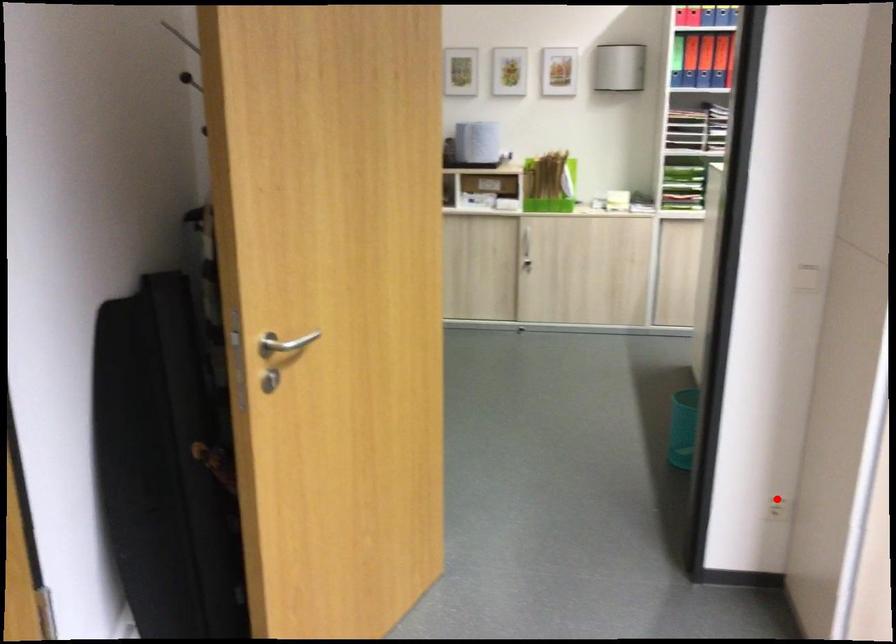
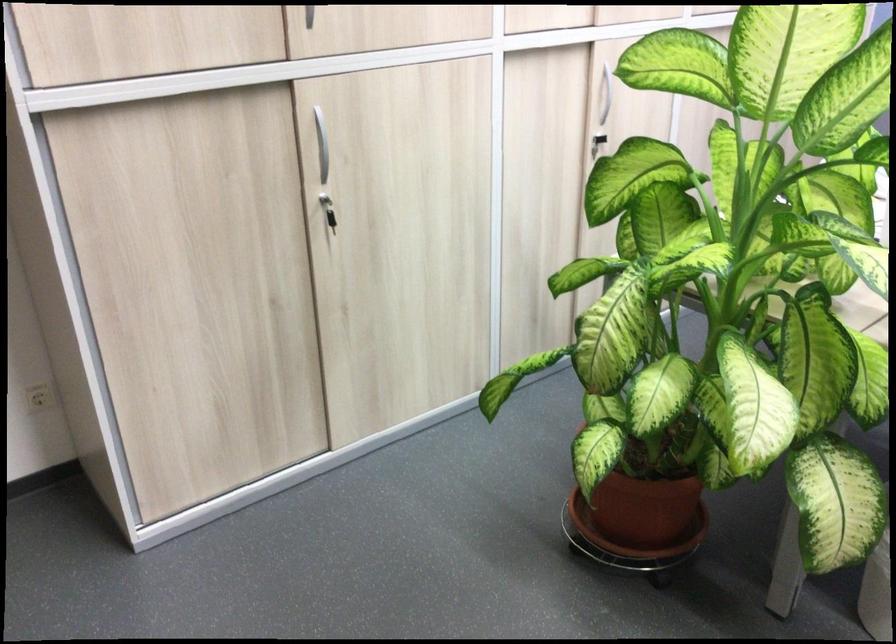
Question: I am providing you with two images of the same scene from different viewpoints. In image1, a red point is highlighted. Considering the same 3D point in image2, which of the following is correct?

Choices:
 (A) It is closer
 (B) It is farther

Answer: (A)